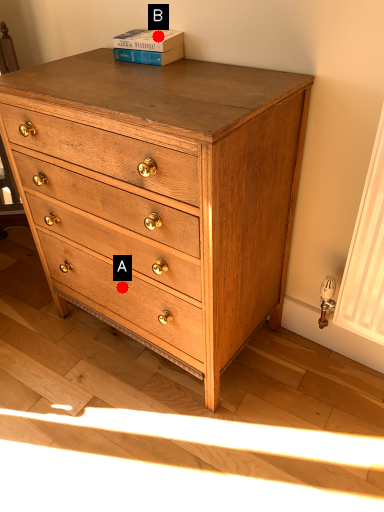
Question: Two points are circled on the image, labeled by A and B beside each circle. Which of the following is the closest to the observer?

Choices:
 (A) A is closer
 (B) B is closer

Answer: (B)